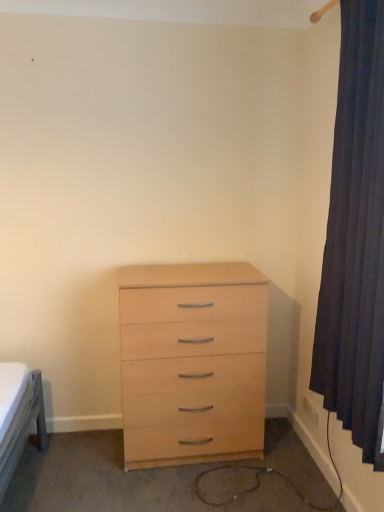
Question: Does dark blue fabric curtain at right lie behind light wood chest of drawers at center?

Choices:
 (A) no
 (B) yes

Answer: (A)

Question: Can you confirm if dark blue fabric curtain at right is shorter than light wood chest of drawers at center?

Choices:
 (A) yes
 (B) no

Answer: (B)

Question: Can you confirm if dark blue fabric curtain at right is positioned to the right of light wood chest of drawers at center?

Choices:
 (A) no
 (B) yes

Answer: (B)

Question: Can we say dark blue fabric curtain at right lies outside light wood chest of drawers at center?

Choices:
 (A) no
 (B) yes

Answer: (B)

Question: From the image's perspective, is dark blue fabric curtain at right on light wood chest of drawers at center?

Choices:
 (A) no
 (B) yes

Answer: (B)

Question: Considering the relative positions of dark blue fabric curtain at right and light wood chest of drawers at center in the image provided, is dark blue fabric curtain at right to the left of light wood chest of drawers at center from the viewer's perspective?

Choices:
 (A) no
 (B) yes

Answer: (A)

Question: Can you confirm if light wood chest of drawers at center is smaller than dark blue fabric curtain at right?

Choices:
 (A) yes
 (B) no

Answer: (B)

Question: Is light wood chest of drawers at center outside of dark blue fabric curtain at right?

Choices:
 (A) yes
 (B) no

Answer: (A)

Question: Are light wood chest of drawers at center and dark blue fabric curtain at right located far from each other?

Choices:
 (A) yes
 (B) no

Answer: (B)

Question: Can you confirm if light wood chest of drawers at center is wider than dark blue fabric curtain at right?

Choices:
 (A) yes
 (B) no

Answer: (A)

Question: From the image's perspective, is light wood chest of drawers at center above dark blue fabric curtain at right?

Choices:
 (A) yes
 (B) no

Answer: (B)

Question: Could dark blue fabric curtain at right be considered to be inside light wood chest of drawers at center?

Choices:
 (A) no
 (B) yes

Answer: (A)

Question: Is point (205, 389) closer or farther from the camera than point (347, 311)?

Choices:
 (A) farther
 (B) closer

Answer: (A)